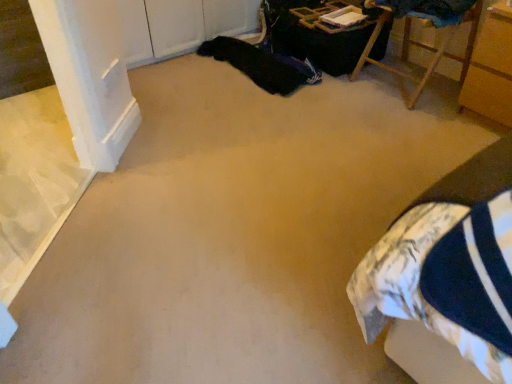
This screenshot has height=384, width=512. I want to click on free space to the left of black fabric at upper center, so click(x=179, y=67).